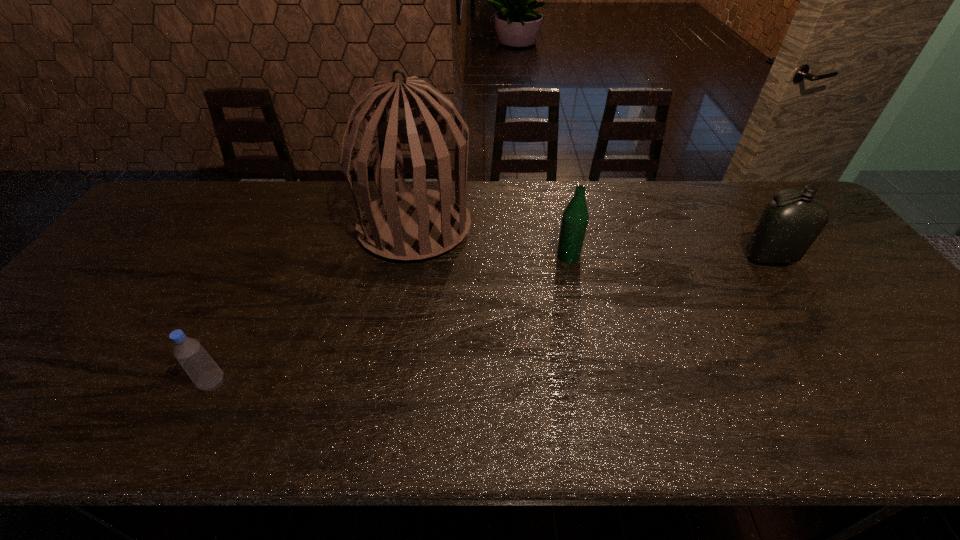
The height and width of the screenshot is (540, 960). In order to click on object that is at the far edge in this screenshot , I will do `click(415, 224)`.

The width and height of the screenshot is (960, 540). In order to click on object present at the right edge in this screenshot , I will do `click(787, 227)`.

You are a GUI agent. You are given a task and a screenshot of the screen. Output one action in this format:
    pyautogui.click(x=<x>, y=<y>)
    Task: Click on the blank space at the far edge of the desktop
    This screenshot has height=540, width=960.
    Given the screenshot: What is the action you would take?
    pyautogui.click(x=645, y=198)

At what (x,y) coordinates should I click in order to perform the action: click on vacant area at the left edge. Please return your answer as a coordinate pair (x, y). The width and height of the screenshot is (960, 540). Looking at the image, I should click on (50, 360).

Where is `free space at the far left corner`? free space at the far left corner is located at coordinates (170, 217).

This screenshot has height=540, width=960. Identify the location of free space that is in between the tallest object and the second bottle from left to right. (492, 241).

The height and width of the screenshot is (540, 960). Find the location of `free space between the rightmost object and the birdcage`. free space between the rightmost object and the birdcage is located at coordinates (592, 242).

You are a GUI agent. You are given a task and a screenshot of the screen. Output one action in this format:
    pyautogui.click(x=<x>, y=<y>)
    Task: Click on the free point between the birdcage and the rightmost object
    
    Given the screenshot: What is the action you would take?
    pyautogui.click(x=592, y=242)

Identify the location of free space that is in between the second bottle from left to right and the rightmost object. The image size is (960, 540). (669, 257).

The image size is (960, 540). Find the location of `vacant area that lies between the rightmost object and the nearest bottle`. vacant area that lies between the rightmost object and the nearest bottle is located at coordinates (492, 320).